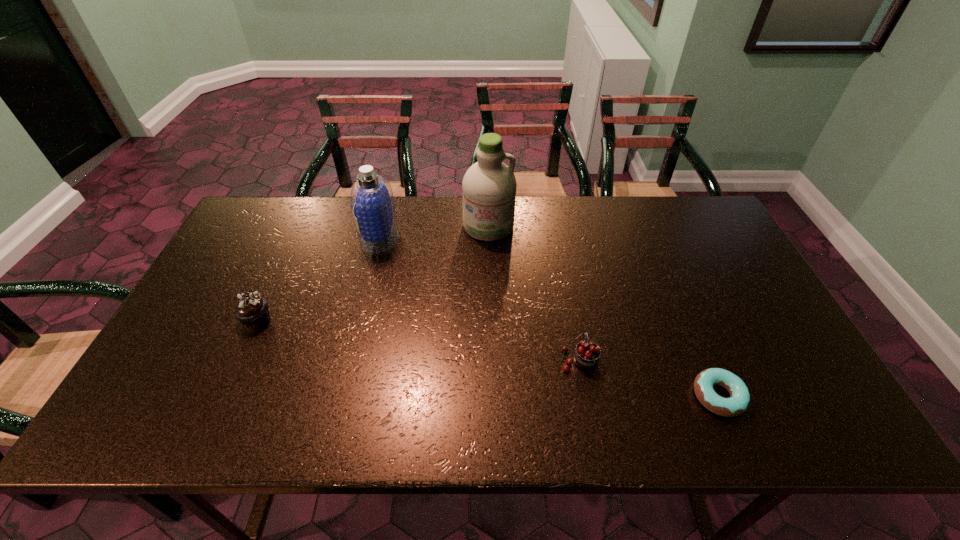
At what (x,y) coordinates should I click in order to perform the action: click on free space that satisfies the following two spatial constraints: 1. on the front side of the rightmost object; 2. on the right side of the cupcake. Please return your answer as a coordinate pair (x, y). This screenshot has height=540, width=960. Looking at the image, I should click on (222, 396).

Identify the location of vacant space that satisfies the following two spatial constraints: 1. on the front side of the nearest object; 2. on the right side of the cupcake. (222, 396).